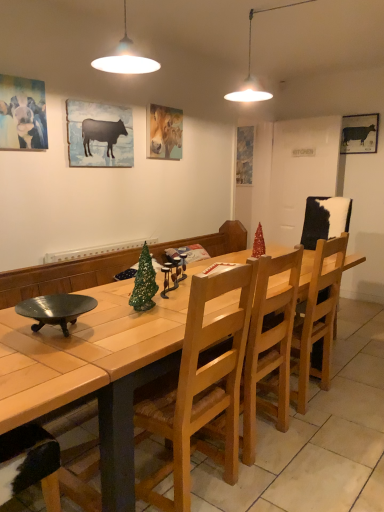
Question: Should I look upward or downward to see shiny metallic bowl at lower left?

Choices:
 (A) down
 (B) up

Answer: (A)

Question: Are matte blue painting at center, the 2th picture frame when ordered from right to left, and black matte cow at upper right, which appears as the first picture frame when viewed from the right, far apart?

Choices:
 (A) no
 (B) yes

Answer: (B)

Question: From the image's perspective, would you say matte blue painting at center, positioned as the first picture frame in back-to-front order, is shown under black matte cow at upper right, which appears as the first picture frame when viewed from the right?

Choices:
 (A) no
 (B) yes

Answer: (B)

Question: Does matte blue painting at center, arranged as the 5th picture frame when viewed from the front, have a greater width compared to black matte cow at upper right, which appears as the first picture frame when viewed from the right?

Choices:
 (A) yes
 (B) no

Answer: (A)

Question: Is matte blue painting at center, positioned as the first picture frame in back-to-front order, positioned in front of black matte cow at upper right, which is counted as the 5th picture frame, starting from the left?

Choices:
 (A) no
 (B) yes

Answer: (A)

Question: Is matte blue painting at center, arranged as the 5th picture frame when viewed from the front, positioned beyond the bounds of black matte cow at upper right, the fourth picture frame viewed from the front?

Choices:
 (A) no
 (B) yes

Answer: (B)

Question: Can you confirm if matte blue painting at center, arranged as the 5th picture frame when viewed from the front, is thinner than black matte cow at upper right, which is counted as the 5th picture frame, starting from the left?

Choices:
 (A) yes
 (B) no

Answer: (B)

Question: Is matte blue painting at center, positioned as the first picture frame in back-to-front order, thinner than wooden table at center?

Choices:
 (A) yes
 (B) no

Answer: (A)

Question: From a real-world perspective, is matte blue painting at center, the 2th picture frame when ordered from right to left, on top of wooden table at center?

Choices:
 (A) yes
 (B) no

Answer: (A)

Question: Can you confirm if matte blue painting at center, positioned as the first picture frame in back-to-front order, is bigger than wooden table at center?

Choices:
 (A) no
 (B) yes

Answer: (A)

Question: Is the position of matte blue painting at center, arranged as the 5th picture frame when viewed from the front, less distant than that of wooden table at center?

Choices:
 (A) no
 (B) yes

Answer: (A)

Question: Is matte blue painting at center, arranged as the 5th picture frame when viewed from the front, not close to wooden table at center?

Choices:
 (A) no
 (B) yes

Answer: (B)

Question: From the image's perspective, would you say matte blue painting at center, the 2th picture frame when ordered from right to left, is positioned over wooden table at center?

Choices:
 (A) no
 (B) yes

Answer: (B)

Question: Could you tell me if light brown wood chair at center, which appears as the second chair when viewed from the back, is facing shiny red christmas tree at center?

Choices:
 (A) no
 (B) yes

Answer: (A)